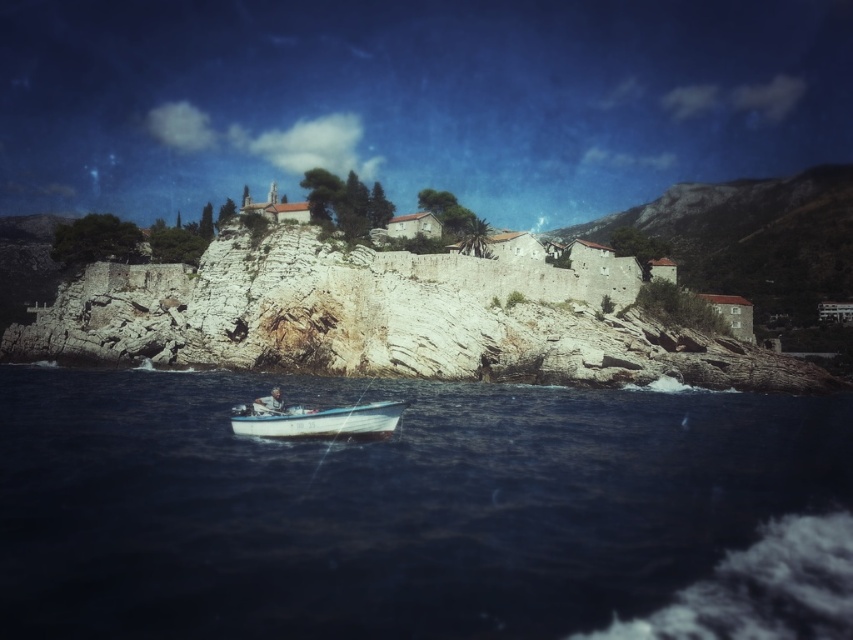
Question: Can you confirm if blue water at lower center is bigger than white matte boat at lower center?

Choices:
 (A) yes
 (B) no

Answer: (A)

Question: Which object is farther from the camera taking this photo?

Choices:
 (A) white matte boat at lower center
 (B) white plastic boat at lower center
 (C) white stone cliff at center

Answer: (C)

Question: Which point appears farthest from the camera in this image?

Choices:
 (A) (277, 387)
 (B) (264, 428)
 (C) (552, 324)

Answer: (C)

Question: Does white stone cliff at center have a lesser width compared to white matte boat at lower center?

Choices:
 (A) no
 (B) yes

Answer: (A)

Question: Can you confirm if blue water at lower center is positioned above white plastic boat at lower center?

Choices:
 (A) yes
 (B) no

Answer: (B)

Question: Which point is farther to the camera?

Choices:
 (A) white matte boat at lower center
 (B) white stone cliff at center
 (C) white plastic boat at lower center

Answer: (B)